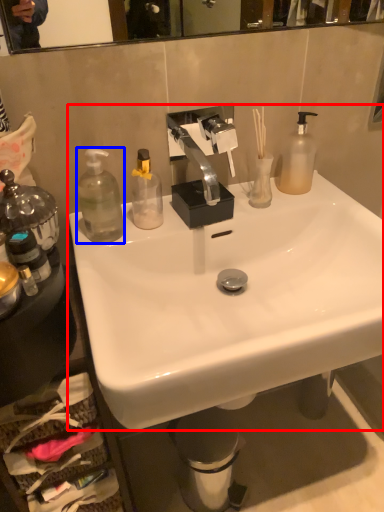
Question: Which of the following is the farthest to the observer, sink (highlighted by a red box) or bottle (highlighted by a blue box)?

Choices:
 (A) sink
 (B) bottle

Answer: (B)